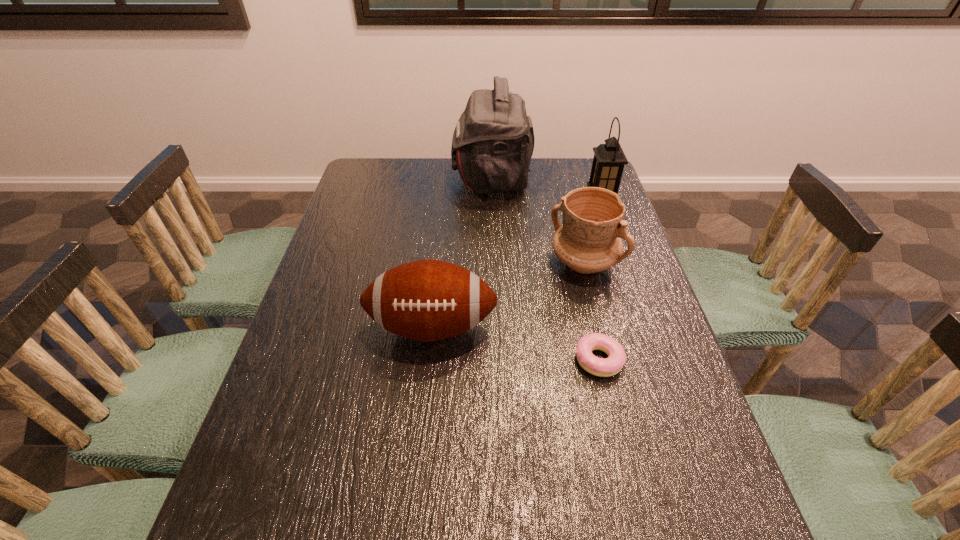
Locate which object is the fourth closest to the football. Please provide its 2D coordinates. Your answer should be formatted as a tuple, i.e. [(x, y)], where the tuple contains the x and y coordinates of a point satisfying the conditions above.

[(609, 160)]

Choose which object is the third nearest neighbor to the shortest object. Please provide its 2D coordinates. Your answer should be formatted as a tuple, i.e. [(x, y)], where the tuple contains the x and y coordinates of a point satisfying the conditions above.

[(609, 160)]

The width and height of the screenshot is (960, 540). I want to click on free region that satisfies the following two spatial constraints: 1. on the open flap of the tallest object; 2. on the back side of the third nearest object, so click(x=494, y=262).

I want to click on free point that satisfies the following two spatial constraints: 1. on the open flap of the pottery; 2. on the left side of the shoulder bag, so click(494, 262).

Find the location of a particular element. Image resolution: width=960 pixels, height=540 pixels. free space that satisfies the following two spatial constraints: 1. on the laces of the football; 2. on the right side of the doughnut is located at coordinates (428, 360).

In order to click on vacant space that satisfies the following two spatial constraints: 1. on the open flap of the shortest object; 2. on the right side of the tallest object in this screenshot , I will do `click(497, 360)`.

At what (x,y) coordinates should I click in order to perform the action: click on free location that satisfies the following two spatial constraints: 1. on the open flap of the shoulder bag; 2. on the left side of the lantern. Please return your answer as a coordinate pair (x, y). This screenshot has width=960, height=540. Looking at the image, I should click on (492, 199).

The height and width of the screenshot is (540, 960). In order to click on free location that satisfies the following two spatial constraints: 1. on the open flap of the tallest object; 2. on the laces of the football in this screenshot , I will do `click(496, 327)`.

You are a GUI agent. You are given a task and a screenshot of the screen. Output one action in this format:
    pyautogui.click(x=<x>, y=<y>)
    Task: Click on the blank space that satisfies the following two spatial constraints: 1. on the laces of the football; 2. on the right side of the doughnut
    This screenshot has height=540, width=960.
    Given the screenshot: What is the action you would take?
    pyautogui.click(x=428, y=360)